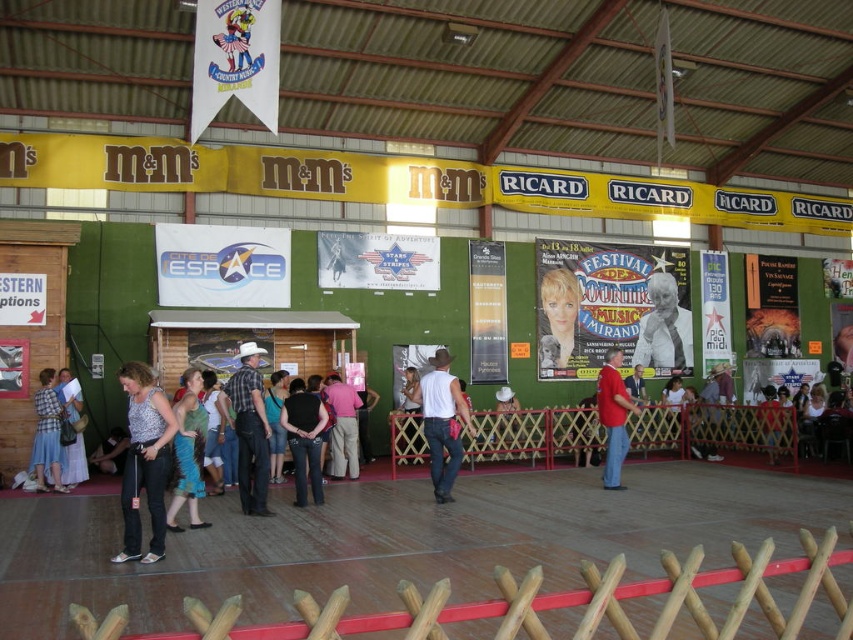
Question: Is matte paper poster at center positioned before black denim jeans at center?

Choices:
 (A) no
 (B) yes

Answer: (A)

Question: Among these points, which one is farthest from the camera?

Choices:
 (A) (97, 467)
 (B) (242, 484)
 (C) (184, 464)
 (D) (294, 408)

Answer: (A)

Question: Which object is positioned closest to the white fabric hat at center?

Choices:
 (A) denim skirt at lower left
 (B) denim jeans at center
 (C) pink cotton shirt at center

Answer: (C)

Question: Which of the following is the closest to the observer?

Choices:
 (A) denim jeans at center
 (B) white fabric hat at center
 (C) wooden fence at lower center
 (D) matte white dress at lower left

Answer: (C)

Question: Is plaid shirt at center to the right of denim jeans at center from the viewer's perspective?

Choices:
 (A) no
 (B) yes

Answer: (B)

Question: Is wooden fence at lower center closer to camera compared to white paper poster at center?

Choices:
 (A) no
 (B) yes

Answer: (B)